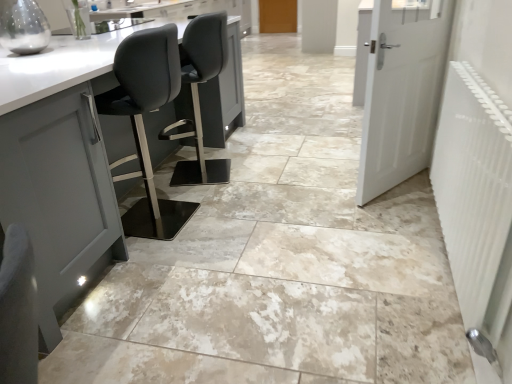
Describe the element at coordinates (401, 91) in the screenshot. The width and height of the screenshot is (512, 384). I see `white matte door at right, which appears as the first door when ordered from the bottom` at that location.

Locate an element on the screen. white textured radiator at right is located at coordinates (476, 197).

What do you see at coordinates (476, 197) in the screenshot? Image resolution: width=512 pixels, height=384 pixels. I see `white textured radiator at right` at bounding box center [476, 197].

Find the location of a particular element. white matte door at right, placed as the first door when sorted from front to back is located at coordinates (401, 91).

Considering the sizes of objects wooden door at center, which is the 1th door in back-to-front order, and white textured radiator at right in the image provided, who is taller, wooden door at center, which is the 1th door in back-to-front order, or white textured radiator at right?

wooden door at center, which is the 1th door in back-to-front order.

From a real-world perspective, is wooden door at center, which is the second door from front to back, positioned over white textured radiator at right based on gravity?

Actually, wooden door at center, which is the second door from front to back, is physically below white textured radiator at right in the real world.

Looking at this image, is wooden door at center, which ranks as the 1th door in top-to-bottom order, next to white textured radiator at right and touching it?

No, wooden door at center, which ranks as the 1th door in top-to-bottom order, is not in contact with white textured radiator at right.

Is wooden door at center, which is the second door from front to back, inside the boundaries of white textured radiator at right, or outside?

wooden door at center, which is the second door from front to back, exists outside the volume of white textured radiator at right.

From a real-world perspective, which is physically above, white textured radiator at right or white matte door at right, which appears as the first door when ordered from the bottom?

In real-world perspective, white matte door at right, which appears as the first door when ordered from the bottom, is above.

From the image's perspective, is white textured radiator at right over white matte door at right, which is the 2th door from top to bottom?

No, from the image's perspective, white textured radiator at right is not on top of white matte door at right, which is the 2th door from top to bottom.

Is white textured radiator at right to the right of white matte door at right, which is the second door in back-to-front order, from the viewer's perspective?

No, white textured radiator at right is not to the right of white matte door at right, which is the second door in back-to-front order.

Looking at this image, is white textured radiator at right positioned with its back to white matte door at right, which appears as the first door when ordered from the bottom?

No, white textured radiator at right is not facing away from white matte door at right, which appears as the first door when ordered from the bottom.

From the picture: Is wooden door at center, which is the 1th door in back-to-front order, located within white textured radiator at right?

That's incorrect, wooden door at center, which is the 1th door in back-to-front order, is not inside white textured radiator at right.

Considering the relative sizes of white textured radiator at right and wooden door at center, which ranks as the 1th door in top-to-bottom order, in the image provided, is white textured radiator at right smaller than wooden door at center, which ranks as the 1th door in top-to-bottom order,?

No, white textured radiator at right is not smaller than wooden door at center, which ranks as the 1th door in top-to-bottom order.

Considering the positions of objects white textured radiator at right and wooden door at center, which ranks as the 1th door in top-to-bottom order, in the image provided, who is more to the left, white textured radiator at right or wooden door at center, which ranks as the 1th door in top-to-bottom order,?

Positioned to the left is wooden door at center, which ranks as the 1th door in top-to-bottom order.

Which of these two, white textured radiator at right or wooden door at center, the 2th door positioned from the bottom, stands shorter?

Standing shorter between the two is white textured radiator at right.

From a real-world perspective, who is located higher, white matte door at right, which is the second door in back-to-front order, or white textured radiator at right?

white matte door at right, which is the second door in back-to-front order, is physically above.

Considering the positions of point (383, 121) and point (456, 238), is point (383, 121) closer or farther from the camera than point (456, 238)?

Point (383, 121) is farther from the camera than point (456, 238).

Is white matte door at right, placed as the first door when sorted from front to back, far from white textured radiator at right?

No, white matte door at right, placed as the first door when sorted from front to back, is not far from white textured radiator at right.

Between point (405, 75) and point (290, 27), which one is positioned in front?

Point (405, 75)

In terms of size, does white matte door at right, which appears as the first door when ordered from the bottom, appear bigger or smaller than wooden door at center, which is the 1th door in back-to-front order?

white matte door at right, which appears as the first door when ordered from the bottom, is bigger than wooden door at center, which is the 1th door in back-to-front order.

Identify the location of door below the wooden door at center, which ranks as the 1th door in top-to-bottom order (from the image's perspective). (401, 91).

Can you tell me how much white matte door at right, which is the 2th door from top to bottom, and wooden door at center, the 2th door positioned from the bottom, differ in facing direction?

122 degrees.

Is white matte door at right, placed as the first door when sorted from front to back, completely or partially inside wooden door at center, which is the second door from front to back?

No, white matte door at right, placed as the first door when sorted from front to back, is not surrounded by wooden door at center, which is the second door from front to back.

From a real-world perspective, is wooden door at center, which is the 1th door in back-to-front order, physically located above or below white matte door at right, which appears as the first door when ordered from the bottom?

wooden door at center, which is the 1th door in back-to-front order, is situated lower than white matte door at right, which appears as the first door when ordered from the bottom, in the real world.

In the image, is wooden door at center, which is the second door from front to back, on the left side or the right side of white matte door at right, which appears as the first door when ordered from the bottom?

wooden door at center, which is the second door from front to back, is positioned on white matte door at right, which appears as the first door when ordered from the bottom,'s left side.

Find the location of `door that appears on the left of white textured radiator at right`. door that appears on the left of white textured radiator at right is located at coordinates coord(278,16).

I want to click on radiator below the white matte door at right, placed as the first door when sorted from front to back (from the image's perspective), so 476,197.

Based on their spatial positions, is white textured radiator at right or wooden door at center, which ranks as the 1th door in top-to-bottom order, closer to white matte door at right, placed as the first door when sorted from front to back?

Among the two, white textured radiator at right is located nearer to white matte door at right, placed as the first door when sorted from front to back.

Looking at the image, which one is located closer to wooden door at center, which is the 1th door in back-to-front order, white matte door at right, which is the 2th door from top to bottom, or white textured radiator at right?

white matte door at right, which is the 2th door from top to bottom, is positioned closer to the anchor wooden door at center, which is the 1th door in back-to-front order.

Based on their spatial positions, is wooden door at center, which ranks as the 1th door in top-to-bottom order, or white matte door at right, which appears as the first door when ordered from the bottom, closer to white textured radiator at right?

Among the two, white matte door at right, which appears as the first door when ordered from the bottom, is located nearer to white textured radiator at right.

Which object lies further to the anchor point white textured radiator at right, white matte door at right, which is the second door in back-to-front order, or wooden door at center, which is the second door from front to back?

wooden door at center, which is the second door from front to back, is further to white textured radiator at right.

Based on their spatial positions, is white textured radiator at right or white matte door at right, which is the second door in back-to-front order, further from wooden door at center, which is the 1th door in back-to-front order?

white textured radiator at right.

When comparing their distances from white matte door at right, which is the second door in back-to-front order, does wooden door at center, the 2th door positioned from the bottom, or white textured radiator at right seem further?

wooden door at center, the 2th door positioned from the bottom, lies further to white matte door at right, which is the second door in back-to-front order, than the other object.

Find the location of a particular element. Image resolution: width=512 pixels, height=384 pixels. door positioned between white textured radiator at right and wooden door at center, which is the 1th door in back-to-front order, from near to far is located at coordinates (401, 91).